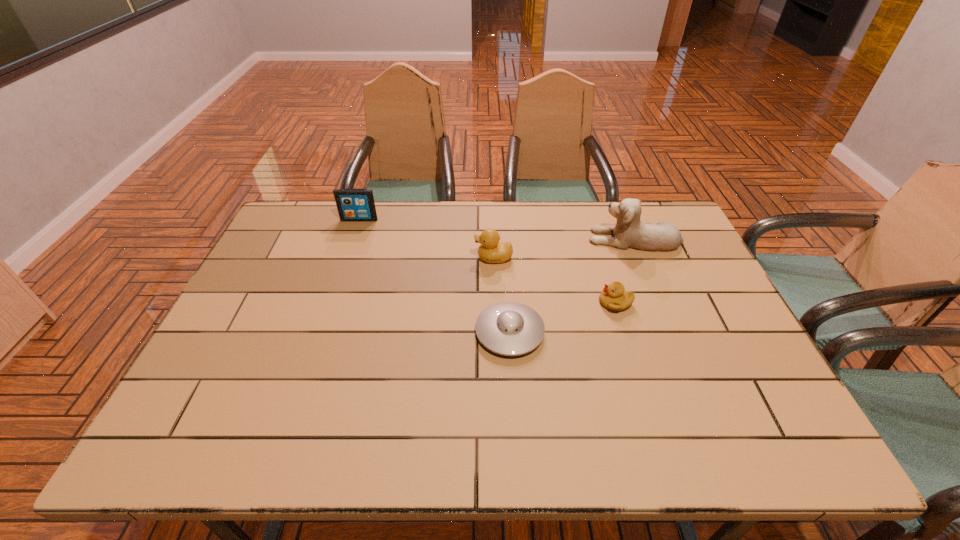
Find the location of a particular element. object that is the fourth closest one to the left duckling is located at coordinates (353, 204).

Find the location of a particular element. The height and width of the screenshot is (540, 960). vacant space that satisfies the following two spatial constraints: 1. on the front screen of the iPod; 2. on the right side of the saucer is located at coordinates (321, 332).

In order to click on free space that satisfies the following two spatial constraints: 1. on the front screen of the leftmost object; 2. on the right side of the saucer in this screenshot , I will do `click(321, 332)`.

Where is `blank space that satisfies the following two spatial constraints: 1. on the front screen of the farthest object; 2. on the left side of the shortest object`? Image resolution: width=960 pixels, height=540 pixels. blank space that satisfies the following two spatial constraints: 1. on the front screen of the farthest object; 2. on the left side of the shortest object is located at coordinates (321, 332).

You are a GUI agent. You are given a task and a screenshot of the screen. Output one action in this format:
    pyautogui.click(x=<x>, y=<y>)
    Task: Click on the vacant position in the image that satisfies the following two spatial constraints: 1. facing forward on the left duckling; 2. on the back side of the shortest object
    
    Given the screenshot: What is the action you would take?
    pyautogui.click(x=496, y=332)

Locate an element on the screen. free location that satisfies the following two spatial constraints: 1. on the front-facing side of the tallest object; 2. on the front side of the shortest object is located at coordinates (673, 332).